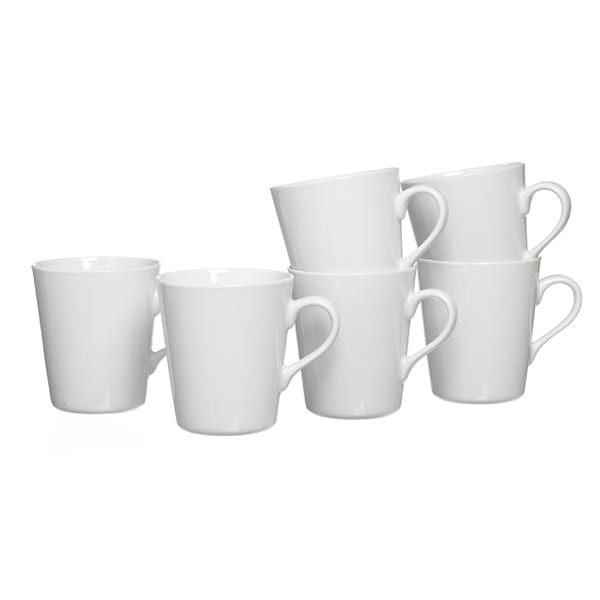
Where is `white coffee cups`? white coffee cups is located at coordinates (98, 309), (240, 334), (325, 216), (364, 340), (486, 214), (481, 330).